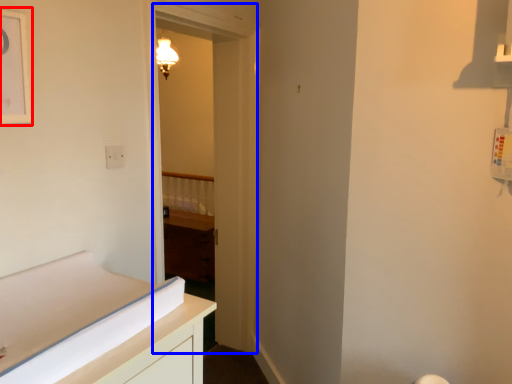
Question: Among these objects, which one is nearest to the camera, picture frame (highlighted by a red box) or door (highlighted by a blue box)?

Choices:
 (A) picture frame
 (B) door

Answer: (A)